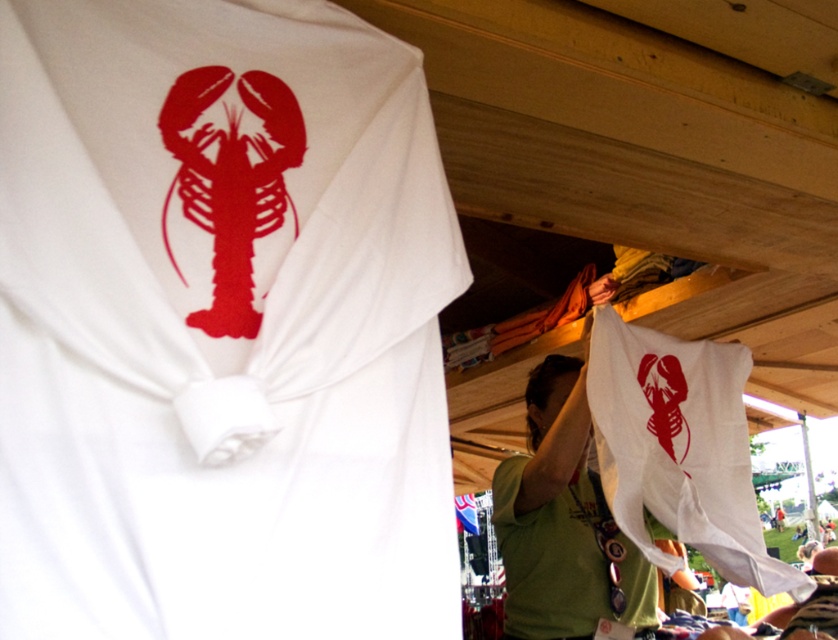
You are organizing a display for a summer sale and need to decide where to place the white matte lobster at center and the white fabric bag at lower right. Given their sizes, which item should be placed in a spot that requires less horizontal space?

The white matte lobster at center has a lesser width compared to the white fabric bag at lower right, so it should be placed in a spot that requires less horizontal space.

You are a customer at an outdoor market and see two items displayed at the stall. The items are the white matte lobster at center and the white matte cloth at center. Which item is taller?

The white matte lobster at center is much taller than the white matte cloth at center.

You are setting up a booth at an outdoor event and need to arrange items. You have a white fabric bag at lower right and a white matte cloth at center. Which item is located to the right of the other?

The white fabric bag at lower right is positioned on the right side of white matte cloth at center.